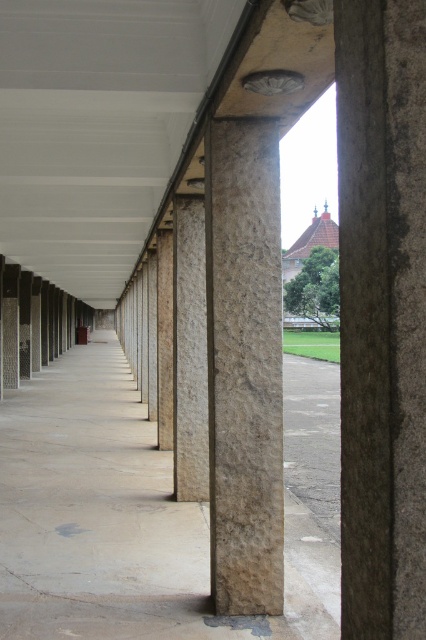
You are a maintenance worker needing to replace a damaged column. You have a 5 meter long ladder. Can you safely reach the top of the natural stone column at center from the brown rough stone column at center using the ladder?

The distance between the natural stone column at center and the brown rough stone column at center is 4.93 meters, which is less than the ladder length of 5 meters. Therefore, the ladder can span the gap safely.

You are an architect inspecting the walkway structure. You notice two columns, the natural stone column at center and the brown rough stone column at center. Which column is directly above the other?

The natural stone column at center is positioned under the brown rough stone column at center, so the brown rough stone column at center is directly above the natural stone column at center.